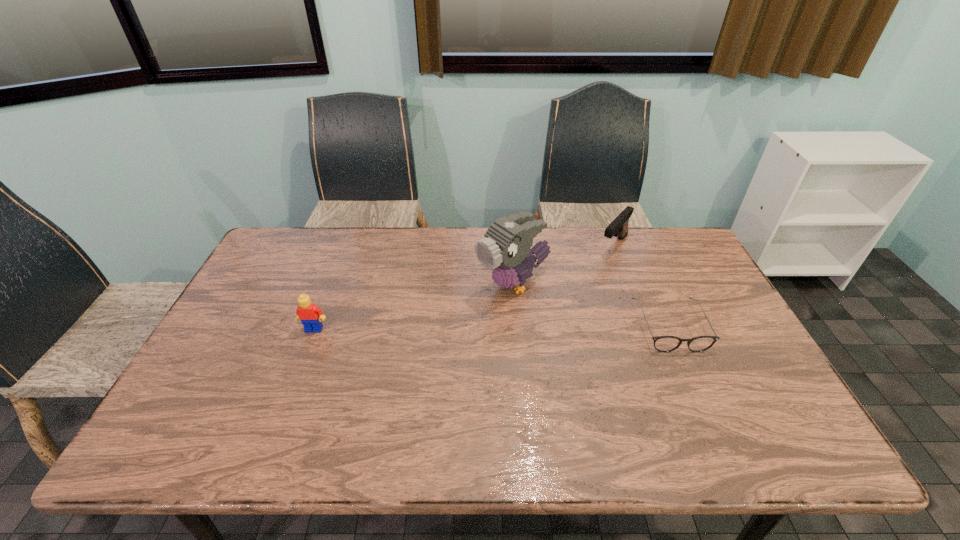
Identify the location of the leftmost object. click(310, 315).

Locate an element on the screen. The image size is (960, 540). the shortest object is located at coordinates (661, 343).

The height and width of the screenshot is (540, 960). I want to click on the farthest object, so click(x=618, y=227).

Find the location of a particular element. the third object from right to left is located at coordinates (506, 249).

Where is `bird`? bird is located at coordinates (506, 249).

Identify the location of free spot located 0.120m on the face of the leftmost object. (300, 368).

Locate an element on the screen. This screenshot has width=960, height=540. vacant space located through the lenses of the spectacles is located at coordinates (708, 414).

Where is `blank space located on the front-facing side of the farthest object`? The image size is (960, 540). blank space located on the front-facing side of the farthest object is located at coordinates (594, 271).

Where is `blank space located 0.320m on the front-facing side of the farthest object`? blank space located 0.320m on the front-facing side of the farthest object is located at coordinates (559, 311).

Find the location of a particular element. The image size is (960, 540). free spot located 0.390m on the front-facing side of the farthest object is located at coordinates (546, 325).